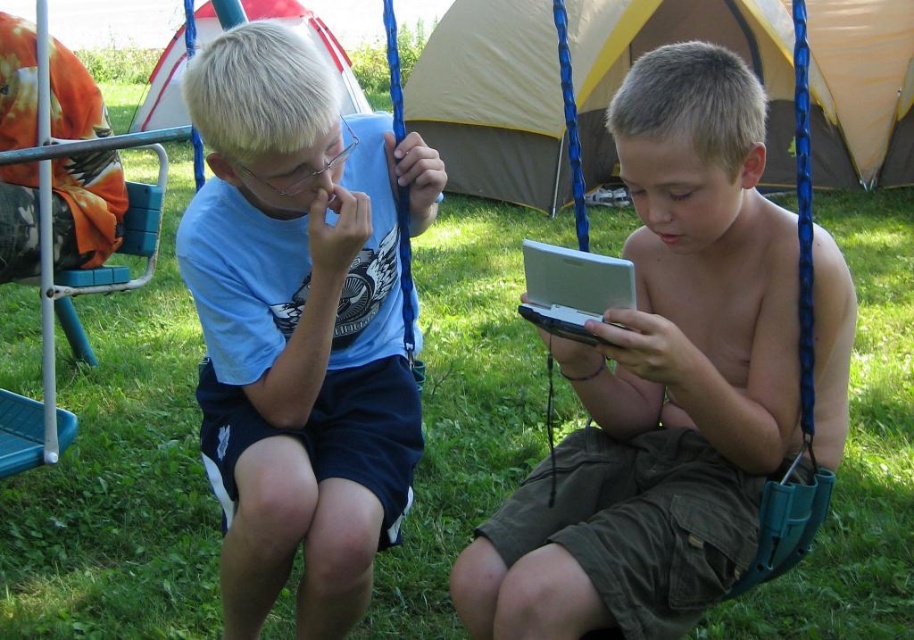
You are a photographer trying to capture the exact location of the point at coordinates (300, 326) in the image. Based on the scene, which object is this point located on?

The point at coordinates (300, 326) is located on the blue matte shirt at left.

Based on the scene description, which tent could potentially accommodate more people comfortably, the tan canvas tent at center or the red and white striped tent at upper left?

The tan canvas tent at center might be wider than red and white striped tent at upper left, so it could potentially accommodate more people comfortably.